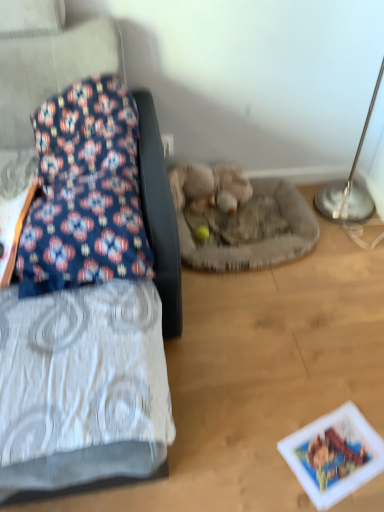
The image size is (384, 512). I want to click on vacant space in front of silver metallic table lamp at upper right, so click(348, 261).